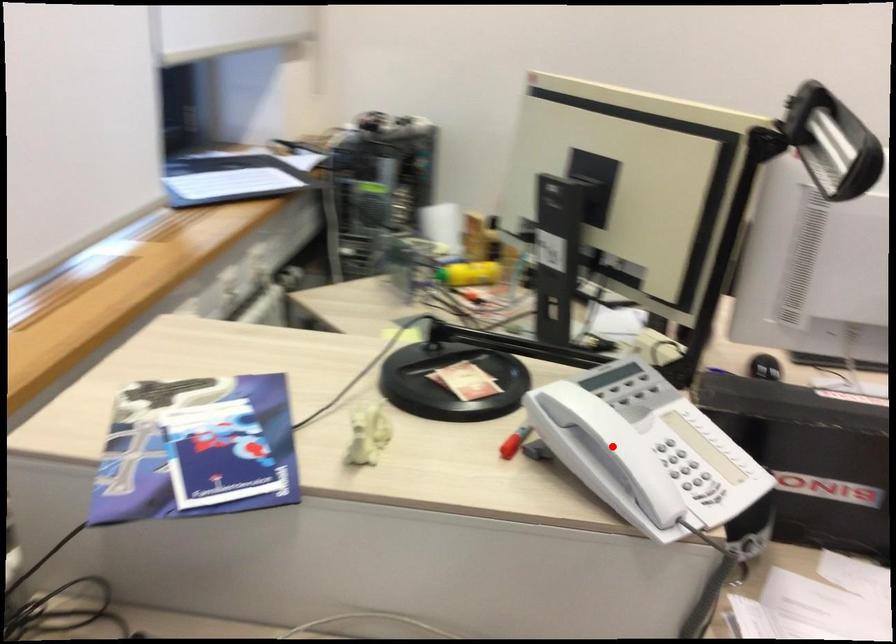
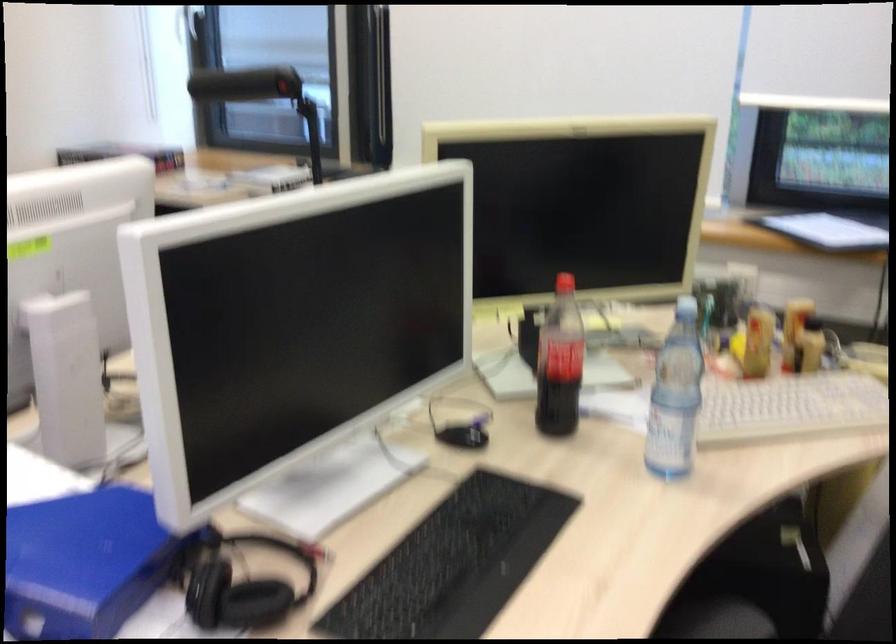
Question: I am providing you with two images of the same scene from different viewpoints. A red point is marked on the first image. Is the red point's position out of view in image 2?

Choices:
 (A) Yes
 (B) No

Answer: (A)